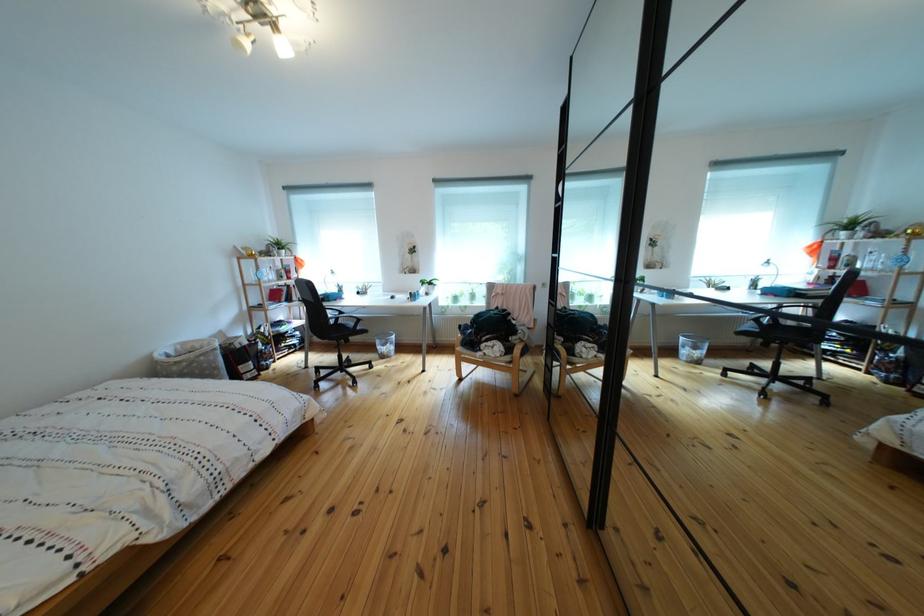
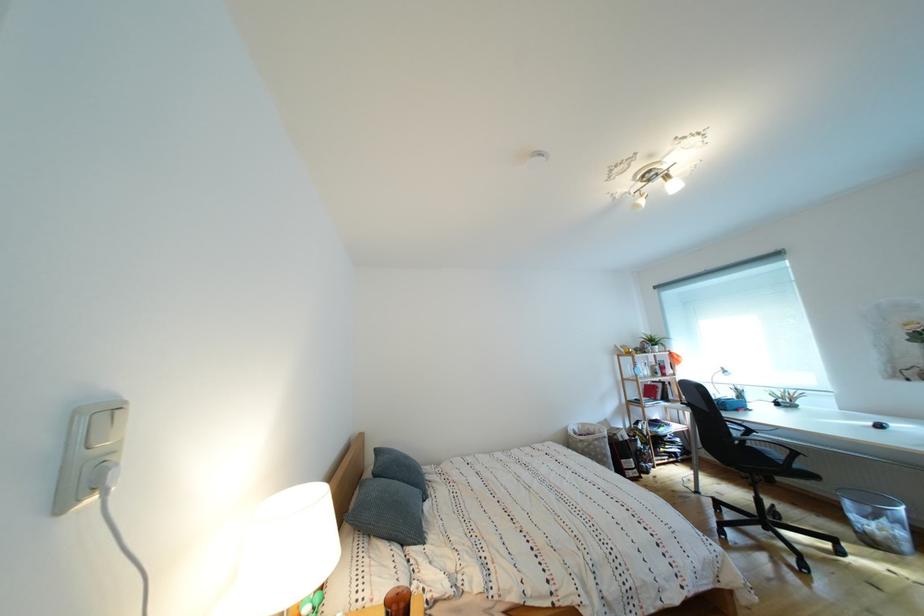
Locate, in the second image, the point that corresponds to (x=282, y=286) in the first image.

(657, 383)